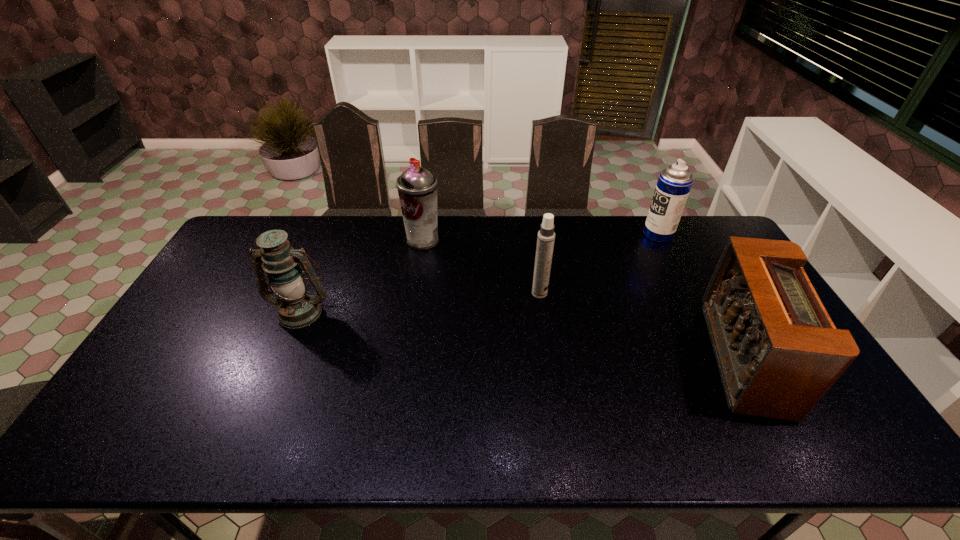
Where is `object that is the closest to the leftmost object`? object that is the closest to the leftmost object is located at coordinates (417, 187).

Where is `aerosol can that is the second closest to the fourth object from right to left`? Image resolution: width=960 pixels, height=540 pixels. aerosol can that is the second closest to the fourth object from right to left is located at coordinates (674, 183).

Identify the location of aerosol can that is the nearest to the third object from left to right. Image resolution: width=960 pixels, height=540 pixels. (417, 187).

Find the location of `free spot that satisfies the following two spatial constraints: 1. on the front side of the nearest aerosol can; 2. on the right side of the radio receiver`. free spot that satisfies the following two spatial constraints: 1. on the front side of the nearest aerosol can; 2. on the right side of the radio receiver is located at coordinates (549, 357).

You are a GUI agent. You are given a task and a screenshot of the screen. Output one action in this format:
    pyautogui.click(x=<x>, y=<y>)
    Task: Click on the free space in the image that satisfies the following two spatial constraints: 1. on the back side of the leftmost aerosol can; 2. on the left side of the leftmost object
    Image resolution: width=960 pixels, height=540 pixels.
    Given the screenshot: What is the action you would take?
    pyautogui.click(x=330, y=240)

Locate an element on the screen. Image resolution: width=960 pixels, height=540 pixels. vacant region that satisfies the following two spatial constraints: 1. on the back side of the leftmost aerosol can; 2. on the right side of the leftmost object is located at coordinates (330, 240).

This screenshot has height=540, width=960. Find the location of `free region that satisfies the following two spatial constraints: 1. on the front side of the leftmost aerosol can; 2. on the right side of the second aerosol can from left to right`. free region that satisfies the following two spatial constraints: 1. on the front side of the leftmost aerosol can; 2. on the right side of the second aerosol can from left to right is located at coordinates (415, 293).

Where is `free space that satisfies the following two spatial constraints: 1. on the back side of the third object from right to left; 2. on the right side of the leftmost object`? The height and width of the screenshot is (540, 960). free space that satisfies the following two spatial constraints: 1. on the back side of the third object from right to left; 2. on the right side of the leftmost object is located at coordinates (308, 293).